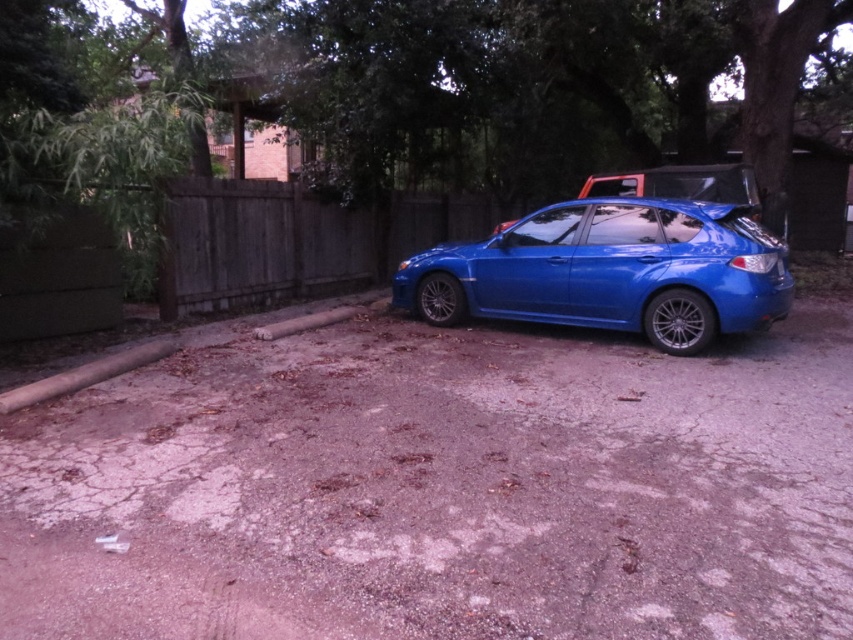
Who is more distant from viewer, (814, 513) or (631, 301)?

Point (631, 301)

Can you confirm if dirt track at center is positioned to the left of glossy blue hatchback at center?

Correct, you'll find dirt track at center to the left of glossy blue hatchback at center.

Between point (784, 544) and point (619, 237), which one is positioned behind?

The point (619, 237) is more distant.

This screenshot has width=853, height=640. In order to click on dirt track at center in this screenshot , I will do `click(442, 490)`.

Which is more to the left, glossy blue hatchback at center or wooden fence at center?

wooden fence at center is more to the left.

Between glossy blue hatchback at center and wooden fence at center, which one has less height?

With less height is wooden fence at center.

Is point (775, 282) positioned after point (431, 195)?

No, (775, 282) is closer to viewer.

The height and width of the screenshot is (640, 853). In order to click on glossy blue hatchback at center in this screenshot , I will do `click(610, 272)`.

The height and width of the screenshot is (640, 853). Identify the location of dirt track at center. (442, 490).